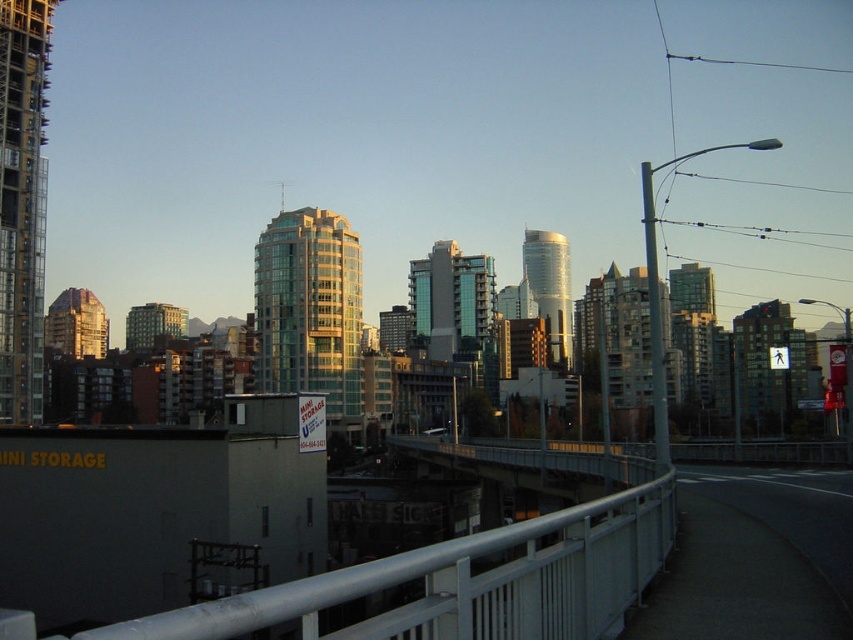
You are standing at the edge of a bridge and see the white metal railing at lower center. If you walk straight ahead along the bridge, will you eventually reach the MINI STORAGE building mentioned in the scene?

The MINI STORAGE building is located below the white metal railing at lower center, so walking straight ahead along the bridge would not lead you directly to it. You would need to go down from the bridge to reach the building.

You are a delivery person trying to determine the best route to deliver packages. You see the white metal railing at lower center and the metallic gray bridge at center. Which object is shorter in height?

The white metal railing at lower center is not as tall as the metallic gray bridge at center, so the white metal railing at lower center is shorter in height.